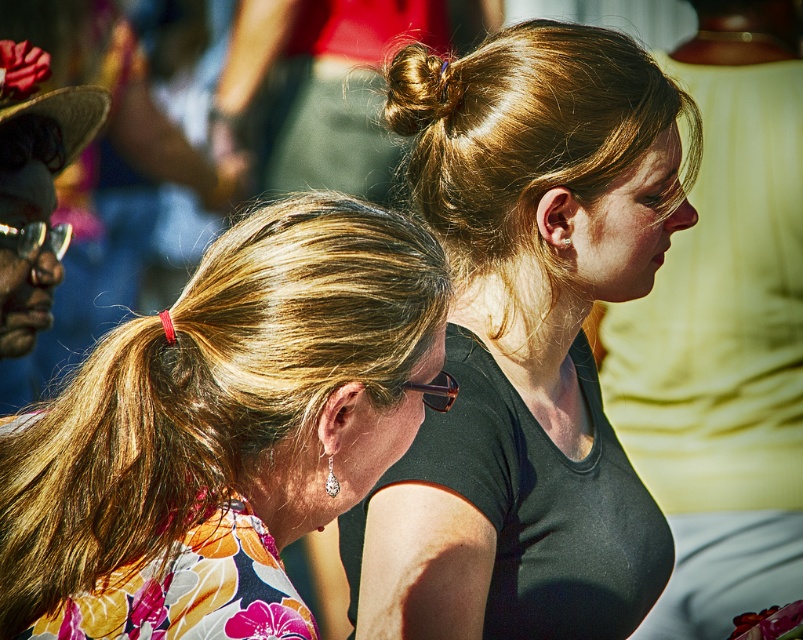
You are observing two people in the scene. Which object is positioned to the right of the other between the black matte shirt at upper center and the blonde hair at center?

The black matte shirt at upper center is positioned to the right of the blonde hair at center.

You are a photographer trying to capture a candid shot of both individuals in the scene. Given that the blonde hair at center and the golden shiny hair at upper center are present, which one is positioned higher up in the frame?

The blonde hair at center is taller than golden shiny hair at upper center, so the blonde hair at center is positioned higher up in the frame.